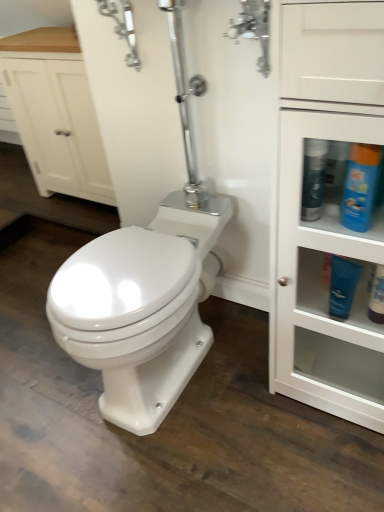
Question: Is polished chrome faucet at upper center to the right of blue glossy bottle at upper right, acting as the second cleaning product starting from the right, from the viewer's perspective?

Choices:
 (A) no
 (B) yes

Answer: (A)

Question: Is polished chrome faucet at upper center further to the viewer compared to blue glossy bottle at upper right, acting as the second cleaning product starting from the right?

Choices:
 (A) yes
 (B) no

Answer: (A)

Question: Is the depth of polished chrome faucet at upper center less than that of blue glossy bottle at upper right, acting as the second cleaning product starting from the right?

Choices:
 (A) yes
 (B) no

Answer: (B)

Question: Is polished chrome faucet at upper center oriented away from blue glossy bottle at upper right, acting as the second cleaning product starting from the right?

Choices:
 (A) yes
 (B) no

Answer: (B)

Question: From the image's perspective, does polished chrome faucet at upper center appear lower than blue glossy bottle at upper right, acting as the second cleaning product starting from the right?

Choices:
 (A) yes
 (B) no

Answer: (B)

Question: Considering their positions, is white wood cabinet at upper left located in front of or behind blue glossy bottle at upper right, placed as the 2th cleaning product when sorted from left to right?

Choices:
 (A) behind
 (B) front

Answer: (A)

Question: From the image's perspective, relative to blue glossy bottle at upper right, placed as the 2th cleaning product when sorted from left to right, is white wood cabinet at upper left above or below?

Choices:
 (A) above
 (B) below

Answer: (A)

Question: Considering the positions of white wood cabinet at upper left and blue glossy bottle at upper right, which is the 1th cleaning product from right to left, in the image, is white wood cabinet at upper left wider or thinner than blue glossy bottle at upper right, which is the 1th cleaning product from right to left,?

Choices:
 (A) thin
 (B) wide

Answer: (B)

Question: Looking at the image, does white wood cabinet at upper left seem bigger or smaller compared to blue glossy bottle at upper right, which is the 1th cleaning product from right to left?

Choices:
 (A) big
 (B) small

Answer: (A)

Question: Considering the relative positions of polished chrome faucet at upper center and matte white lotion at lower right, arranged as the second toiletry when viewed from the left, in the image provided, is polished chrome faucet at upper center to the left or to the right of matte white lotion at lower right, arranged as the second toiletry when viewed from the left,?

Choices:
 (A) right
 (B) left

Answer: (B)

Question: Considering the positions of polished chrome faucet at upper center and matte white lotion at lower right, arranged as the second toiletry when viewed from the left, in the image, is polished chrome faucet at upper center wider or thinner than matte white lotion at lower right, arranged as the second toiletry when viewed from the left,?

Choices:
 (A) thin
 (B) wide

Answer: (B)

Question: From a real-world perspective, is polished chrome faucet at upper center above or below matte white lotion at lower right, marked as the first toiletry in a right-to-left arrangement?

Choices:
 (A) below
 (B) above

Answer: (B)

Question: From the image's perspective, relative to matte white lotion at lower right, marked as the first toiletry in a right-to-left arrangement, is polished chrome faucet at upper center above or below?

Choices:
 (A) above
 (B) below

Answer: (A)

Question: Is blue glossy bottle at upper right, placed as the 2th cleaning product when sorted from left to right, inside the boundaries of blue matte lotion at right, which is counted as the 1th toiletry, starting from the left, or outside?

Choices:
 (A) inside
 (B) outside

Answer: (B)

Question: Considering the positions of blue glossy bottle at upper right, placed as the 2th cleaning product when sorted from left to right, and blue matte lotion at right, the second toiletry in the right-to-left sequence, in the image, is blue glossy bottle at upper right, placed as the 2th cleaning product when sorted from left to right, taller or shorter than blue matte lotion at right, the second toiletry in the right-to-left sequence,?

Choices:
 (A) tall
 (B) short

Answer: (B)